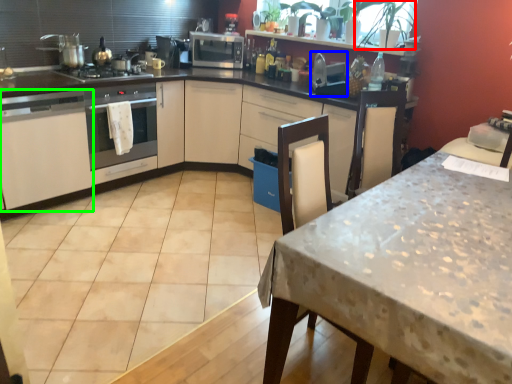
Question: Estimate the real-world distances between objects in this image. Which object is closer to plant (highlighted by a red box), appliance (highlighted by a blue box) or cabinetry (highlighted by a green box)?

Choices:
 (A) appliance
 (B) cabinetry

Answer: (A)